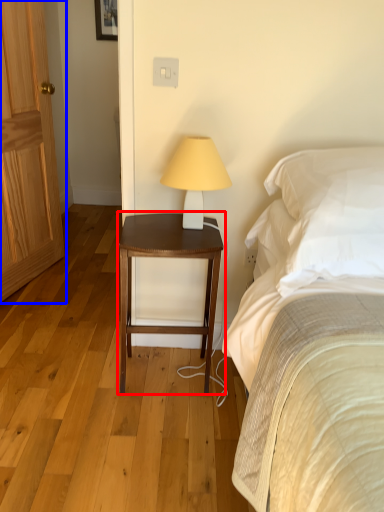
Question: Among these objects, which one is farthest to the camera, nightstand (highlighted by a red box) or door (highlighted by a blue box)?

Choices:
 (A) nightstand
 (B) door

Answer: (B)